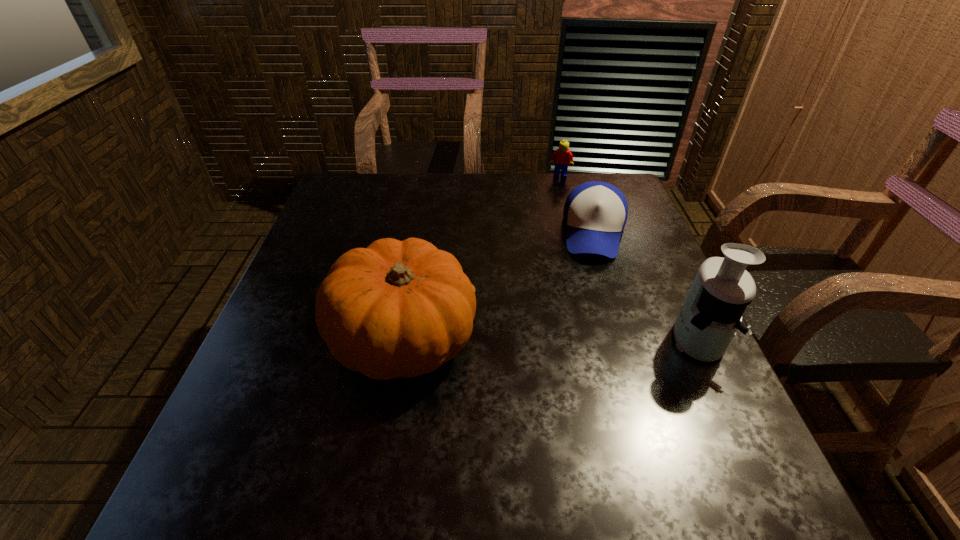
The height and width of the screenshot is (540, 960). What are the coordinates of `object that is at the near left corner` in the screenshot? It's located at (395, 309).

This screenshot has height=540, width=960. In order to click on Lego located at the far right corner in this screenshot , I will do `click(562, 157)`.

Locate an element on the screen. The height and width of the screenshot is (540, 960). baseball cap that is at the far right corner is located at coordinates (595, 213).

The width and height of the screenshot is (960, 540). I want to click on free space at the far edge of the desktop, so click(543, 191).

At what (x,y) coordinates should I click in order to perform the action: click on free region at the near edge of the desktop. Please return your answer as a coordinate pair (x, y). The width and height of the screenshot is (960, 540). Looking at the image, I should click on (466, 439).

In the image, there is a desktop. Identify the location of vacant space at the left edge. (344, 218).

The width and height of the screenshot is (960, 540). In the image, there is a desktop. In order to click on free space at the right edge in this screenshot , I will do `click(683, 300)`.

Where is `free space at the far left corner`? free space at the far left corner is located at coordinates click(x=378, y=183).

The image size is (960, 540). In the image, there is a desktop. In order to click on vacant space at the near left corner in this screenshot , I will do `click(254, 430)`.

At what (x,y) coordinates should I click in order to perform the action: click on vacant space at the far right corner of the desktop. Please return your answer as a coordinate pair (x, y). The width and height of the screenshot is (960, 540). Looking at the image, I should click on (589, 173).